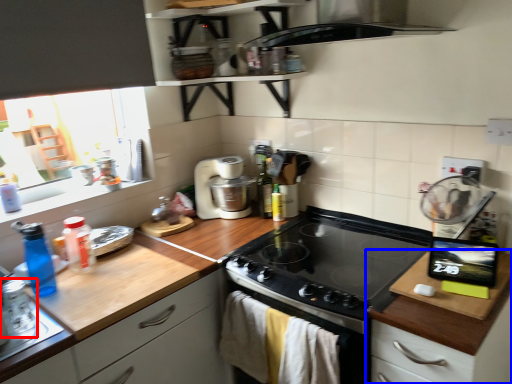
Question: Among these objects, which one is farthest to the camera, appliance (highlighted by a red box) or cabinetry (highlighted by a blue box)?

Choices:
 (A) appliance
 (B) cabinetry

Answer: (A)